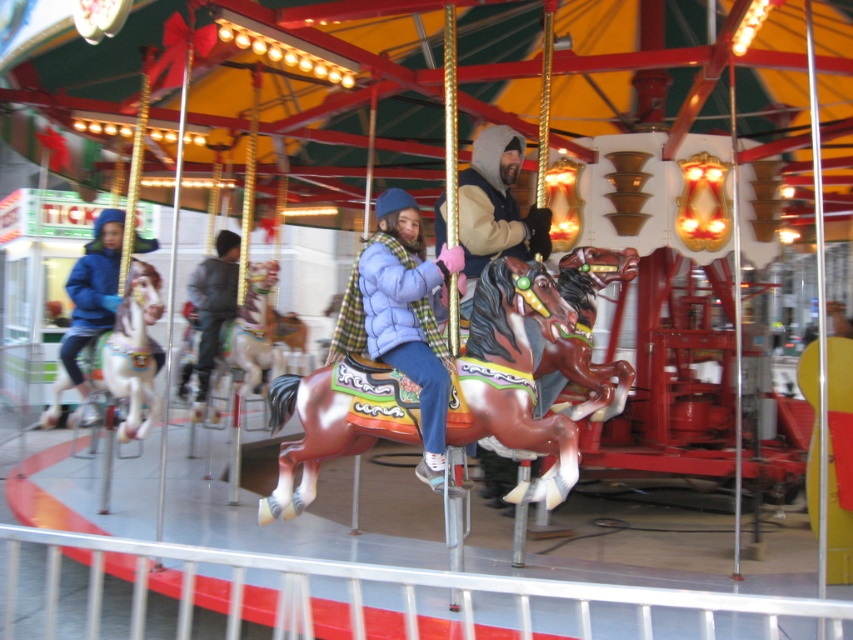
Looking at this image, who is shorter, matte blue jacket at center or white glossy horse at left?

white glossy horse at left is shorter.

Locate an element on the screen. The image size is (853, 640). matte blue jacket at center is located at coordinates (407, 316).

Where is `matte blue jacket at center`? This screenshot has height=640, width=853. matte blue jacket at center is located at coordinates (407, 316).

Based on the photo, which is more to the right, matte blue jacket at center or gray fabric jacket at center?

From the viewer's perspective, matte blue jacket at center appears more on the right side.

From the picture: Can you confirm if matte blue jacket at center is wider than gray fabric jacket at center?

In fact, matte blue jacket at center might be narrower than gray fabric jacket at center.

Is point (412, 202) farther from viewer compared to point (212, 285)?

No, it is not.

This screenshot has height=640, width=853. I want to click on matte blue jacket at center, so click(407, 316).

Does matte brown horse at center have a smaller size compared to gray fabric jacket at center?

Indeed, matte brown horse at center has a smaller size compared to gray fabric jacket at center.

Who is lower down, matte brown horse at center or gray fabric jacket at center?

gray fabric jacket at center is below.

Image resolution: width=853 pixels, height=640 pixels. What do you see at coordinates (495, 208) in the screenshot?
I see `matte brown horse at center` at bounding box center [495, 208].

Where is `matte brown horse at center`? This screenshot has width=853, height=640. matte brown horse at center is located at coordinates (495, 208).